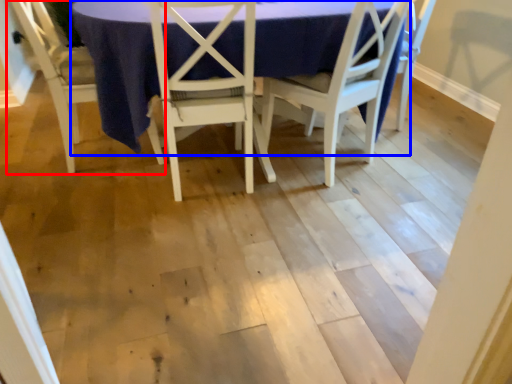
Question: Which of the following is the farthest to the observer, chair (highlighted by a red box) or round table (highlighted by a blue box)?

Choices:
 (A) chair
 (B) round table

Answer: (A)